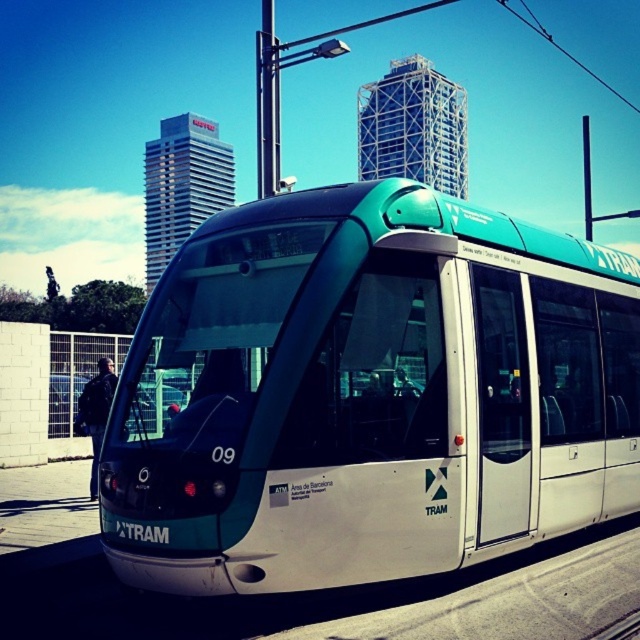
You are a passenger waiting at the tram station. You notice the teal glossy tram at center and the black leather jacket at left. Which object is closer to you?

The black leather jacket at left is closer to you because the teal glossy tram at center has a smaller size compared to black leather jacket at left, indicating it is farther away.